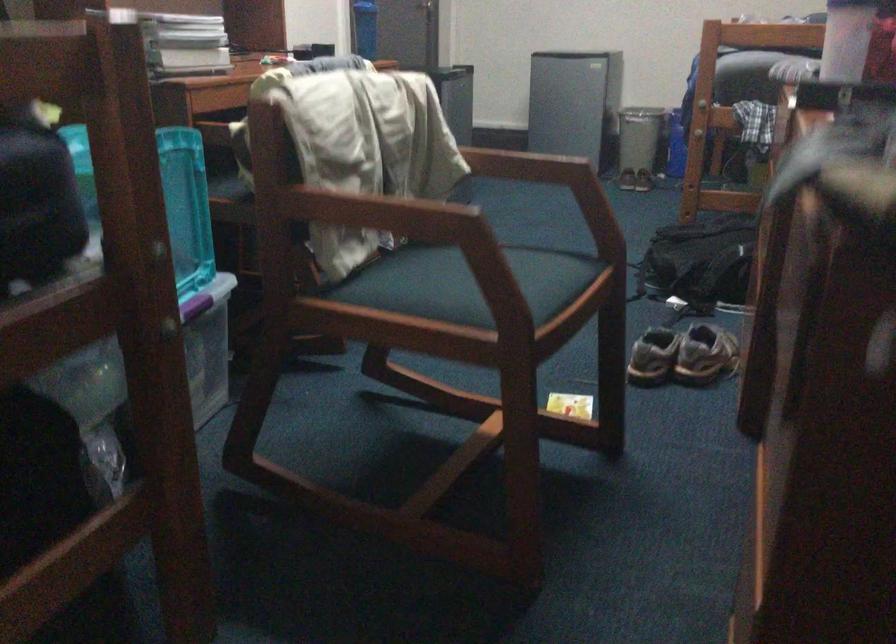
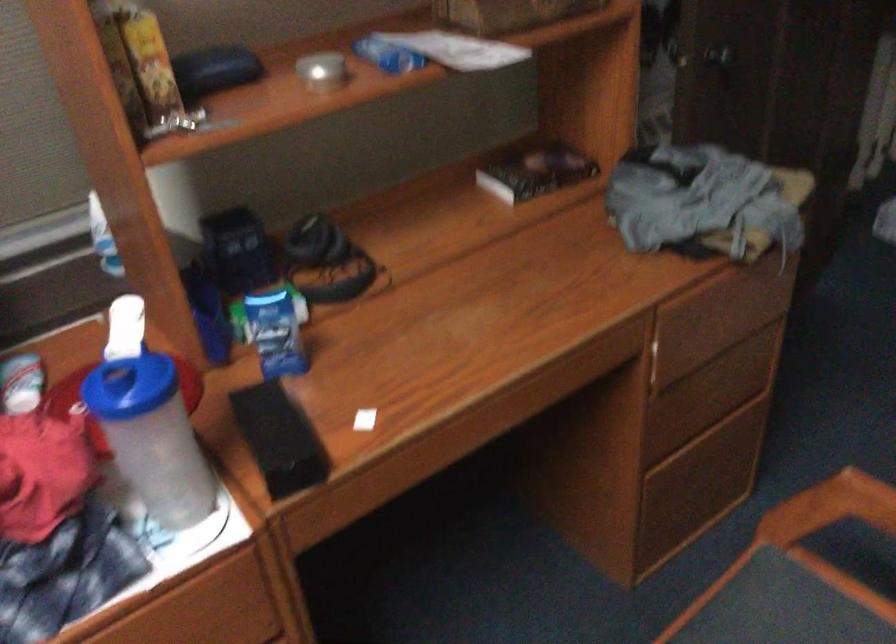
Locate, in the second image, the point that corresponds to pixel 539 279 in the first image.

(830, 507)